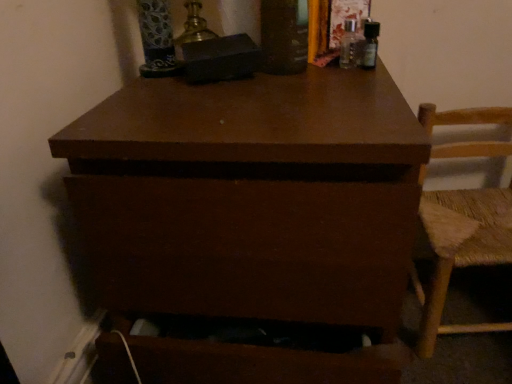
Question: Would you say brown matte chest of drawers at center is inside or outside woven straw chair at right?

Choices:
 (A) outside
 (B) inside

Answer: (A)

Question: Is brown matte chest of drawers at center bigger or smaller than woven straw chair at right?

Choices:
 (A) big
 (B) small

Answer: (A)

Question: Is point (257, 309) positioned closer to the camera than point (474, 331)?

Choices:
 (A) farther
 (B) closer

Answer: (B)

Question: Is woven straw chair at right in front of or behind brown matte chest of drawers at center in the image?

Choices:
 (A) front
 (B) behind

Answer: (B)

Question: Is point (510, 110) closer or farther from the camera than point (294, 276)?

Choices:
 (A) farther
 (B) closer

Answer: (A)

Question: From their relative heights in the image, would you say woven straw chair at right is taller or shorter than brown matte chest of drawers at center?

Choices:
 (A) short
 (B) tall

Answer: (A)

Question: Looking at their shapes, would you say woven straw chair at right is wider or thinner than brown matte chest of drawers at center?

Choices:
 (A) thin
 (B) wide

Answer: (A)